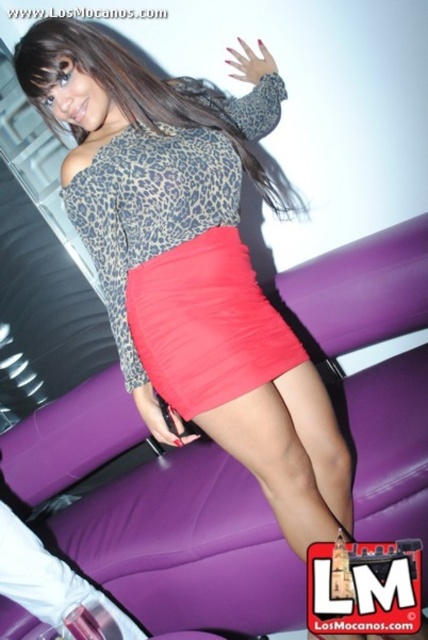
You are a photographer adjusting your camera settings in the studio. You notice the shiny coral skirt at center and the leopard print dress at center. Which clothing item is closer to your camera lens?

The shiny coral skirt at center is closer to the camera lens because it is positioned further to the viewer than the leopard print dress at center.

You are a fashion designer observing the studio setup. You notice the matte red skirt at center and the leopard print dress at center. Which clothing item is located to the left of the other?

The matte red skirt at center is positioned on the left side of leopard print dress at center, so the matte red skirt at center is to the left of the leopard print dress at center.

You are a fashion designer who needs to adjust the placement of the shiny coral skirt at center and the leopard print dress at center in the photo. The client wants them to be closer together by 5 inches. Is this possible without overlapping?

The shiny coral skirt at center and leopard print dress at center are currently 17.79 inches apart. Reducing the distance by 5 inches would make them 12.79 inches apart, which is feasible without overlapping as they can be moved closer while maintaining space between them.